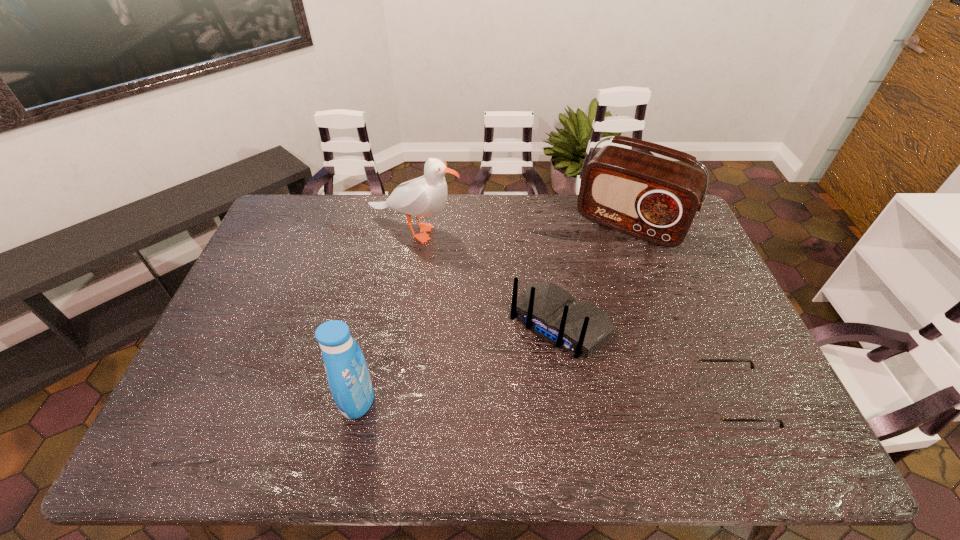
The height and width of the screenshot is (540, 960). I want to click on free space on the desktop that is between the detergent and the shortest object and is positioned at the beak of the gull, so click(x=596, y=399).

This screenshot has height=540, width=960. Find the location of `vacant space on the desktop that is between the detergent and the spectacles and is positioned on the front panel of the radio receiver`. vacant space on the desktop that is between the detergent and the spectacles and is positioned on the front panel of the radio receiver is located at coordinates tap(524, 399).

What are the coordinates of `free spot on the desktop that is between the detergent and the spectacles and is positioned on the back of the router` in the screenshot? It's located at (496, 399).